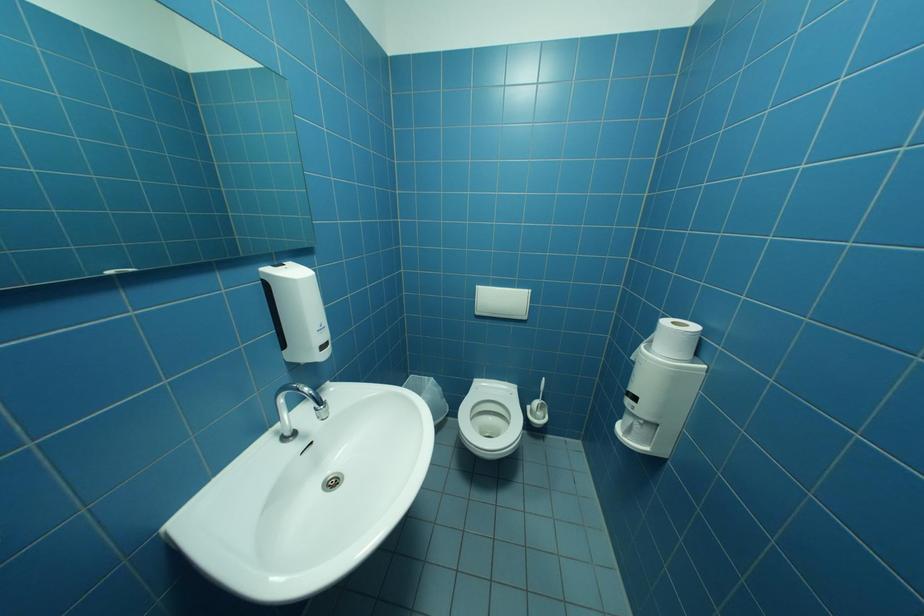
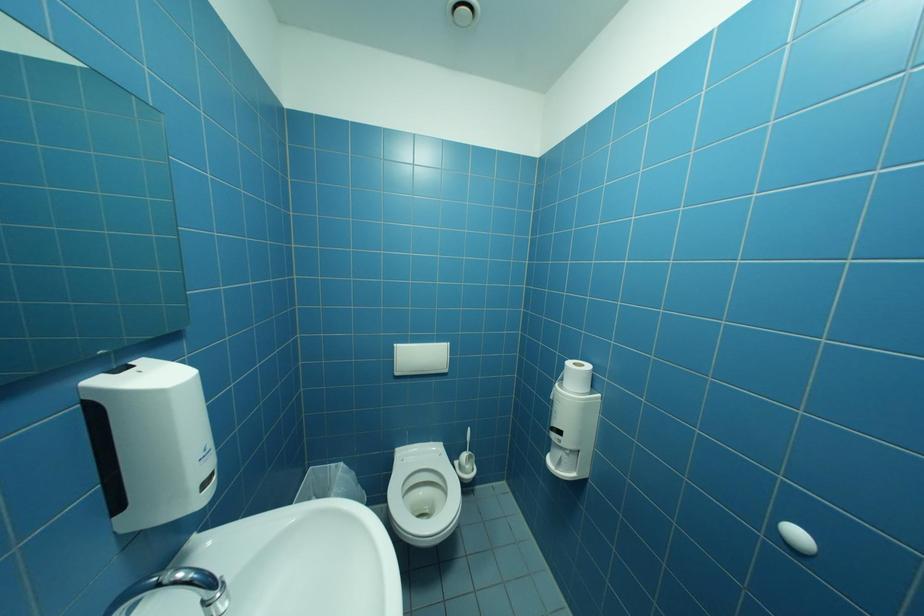
Question: What movement of the cameraman would produce the second image?

Choices:
 (A) Left
 (B) Right
 (C) Forward
 (D) Backward

Answer: (A)